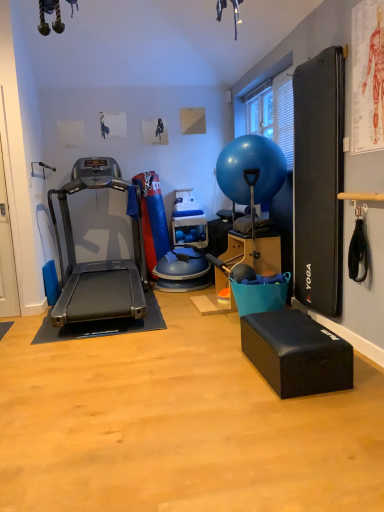
Question: Is black rubber treadmill at left outside black foam footrest at lower right?

Choices:
 (A) no
 (B) yes

Answer: (B)

Question: Would you say black foam footrest at lower right is part of black rubber treadmill at left's contents?

Choices:
 (A) yes
 (B) no

Answer: (B)

Question: Is black rubber treadmill at left positioned far away from black foam footrest at lower right?

Choices:
 (A) no
 (B) yes

Answer: (B)

Question: Can you confirm if black rubber treadmill at left is positioned to the right of black foam footrest at lower right?

Choices:
 (A) yes
 (B) no

Answer: (B)

Question: Is black rubber treadmill at left at the left side of black foam footrest at lower right?

Choices:
 (A) yes
 (B) no

Answer: (A)

Question: Are black rubber treadmill at left and black foam footrest at lower right making contact?

Choices:
 (A) no
 (B) yes

Answer: (A)

Question: Is black foam footrest at lower right looking in the opposite direction of blue rubber ball at center?

Choices:
 (A) yes
 (B) no

Answer: (B)

Question: From a real-world perspective, does black foam footrest at lower right stand above blue rubber ball at center?

Choices:
 (A) no
 (B) yes

Answer: (A)

Question: Does black foam footrest at lower right have a greater width compared to blue rubber ball at center?

Choices:
 (A) no
 (B) yes

Answer: (A)

Question: Is black foam footrest at lower right positioned beyond the bounds of blue rubber ball at center?

Choices:
 (A) no
 (B) yes

Answer: (B)

Question: Does black foam footrest at lower right have a lesser width compared to blue rubber ball at center?

Choices:
 (A) yes
 (B) no

Answer: (A)

Question: Can you confirm if black foam footrest at lower right is positioned to the left of blue rubber ball at center?

Choices:
 (A) no
 (B) yes

Answer: (A)

Question: From the image's perspective, is black foam footrest at lower right over black rubber treadmill at left?

Choices:
 (A) yes
 (B) no

Answer: (B)